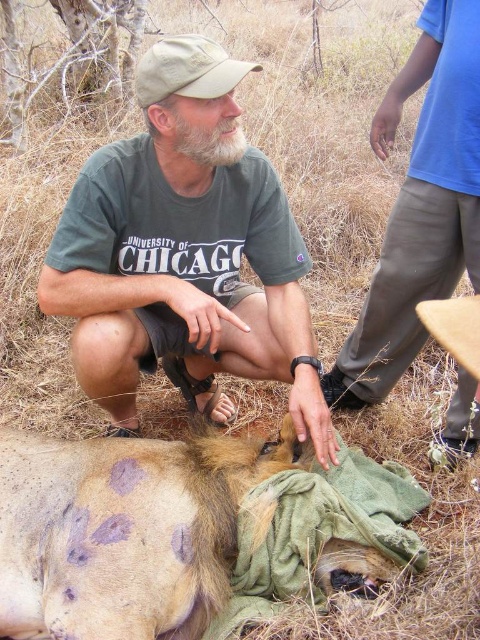
Question: Which object is farther from the camera taking this photo?

Choices:
 (A) green cotton t-shirt at center
 (B) green soft cloth at lower center

Answer: (A)

Question: Observing the image, what is the correct spatial positioning of green cotton t-shirt at center in reference to green soft cloth at lower center?

Choices:
 (A) right
 (B) left

Answer: (B)

Question: Considering the real-world distances, which object is closest to the green cotton t-shirt at center?

Choices:
 (A) blue cotton shirt at upper right
 (B) green soft cloth at lower center

Answer: (B)

Question: Which point is farther from the camera taking this photo?

Choices:
 (A) (367, 548)
 (B) (421, 160)
 (C) (136, 636)

Answer: (B)

Question: Does green cotton t-shirt at center have a smaller size compared to green soft cloth at lower center?

Choices:
 (A) no
 (B) yes

Answer: (A)

Question: Is blue cotton shirt at upper right closer to the viewer compared to green soft cloth at lower center?

Choices:
 (A) yes
 (B) no

Answer: (B)